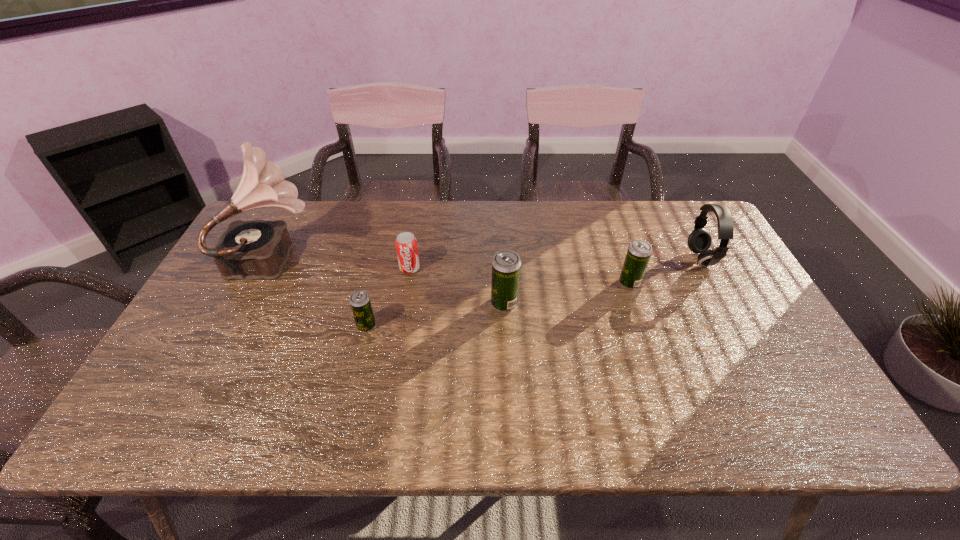
In order to click on the nearest beer can in this screenshot , I will do `click(359, 301)`.

Where is `the shortest beer can`? This screenshot has height=540, width=960. the shortest beer can is located at coordinates (359, 301).

The width and height of the screenshot is (960, 540). In order to click on the third object from right to left in this screenshot , I will do `click(506, 265)`.

You are a GUI agent. You are given a task and a screenshot of the screen. Output one action in this format:
    pyautogui.click(x=<x>, y=<y>)
    Task: Click on the second beer can from left to right
    
    Given the screenshot: What is the action you would take?
    pyautogui.click(x=506, y=265)

I want to click on the farthest beer can, so click(x=638, y=254).

You are a GUI agent. You are given a task and a screenshot of the screen. Output one action in this format:
    pyautogui.click(x=<x>, y=<y>)
    Task: Click on the second tallest beer can
    
    Given the screenshot: What is the action you would take?
    pyautogui.click(x=638, y=254)

I want to click on the leftmost object, so click(x=258, y=249).

You are a GUI agent. You are given a task and a screenshot of the screen. Output one action in this format:
    pyautogui.click(x=<x>, y=<y>)
    Task: Click on the record player
    The height and width of the screenshot is (540, 960).
    Given the screenshot: What is the action you would take?
    pyautogui.click(x=258, y=249)

Find the location of `soda can`. soda can is located at coordinates (406, 245).

What are the coordinates of `earphone` in the screenshot? It's located at pos(699,241).